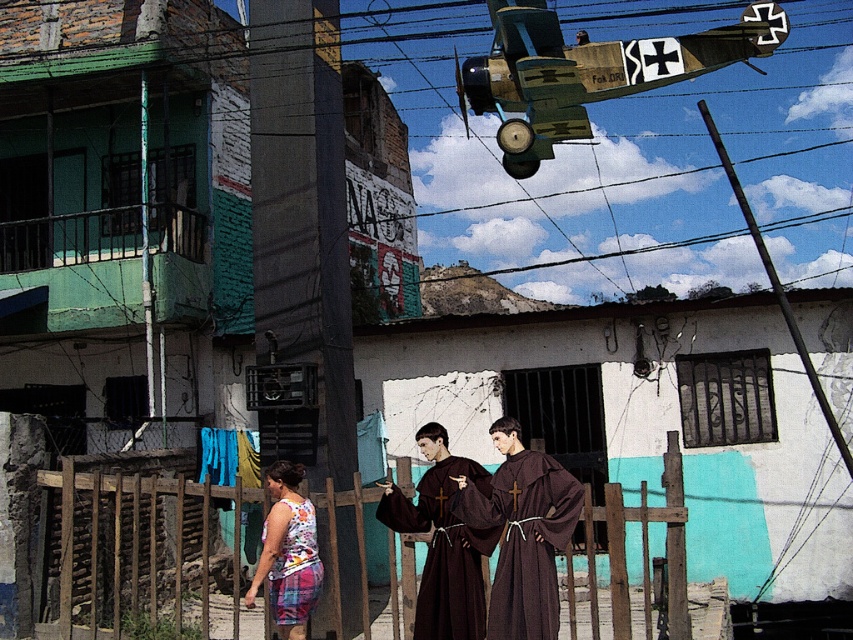
You are a tailor who needs to determine the appropriate fabric length for alterations. Given the brown woolen robe at center and the printed fabric dress at lower center, which garment requires more fabric in terms of width?

The brown woolen robe at center requires more fabric in terms of width because its width is larger than that of the printed fabric dress at lower center.

You are an observer looking at the urban scene described. You notice the camouflage fabric plane at upper right and the printed fabric dress at lower center. Which object is closer to you?

The camouflage fabric plane at upper right is closer to you because it is further to the viewer than the printed fabric dress at lower center.

You are a drone operator trying to locate a specific point in an urban scene. The scene has two people in brown robes near a wooden fence and a white building with teal accents. You need to determine if the point at coordinates (x=587, y=72) is on the camouflage fabric plane at upper right. Based on the scene description, can you confirm this?

Yes, the point at coordinates (x=587, y=72) is on the camouflage fabric plane at upper right as described.